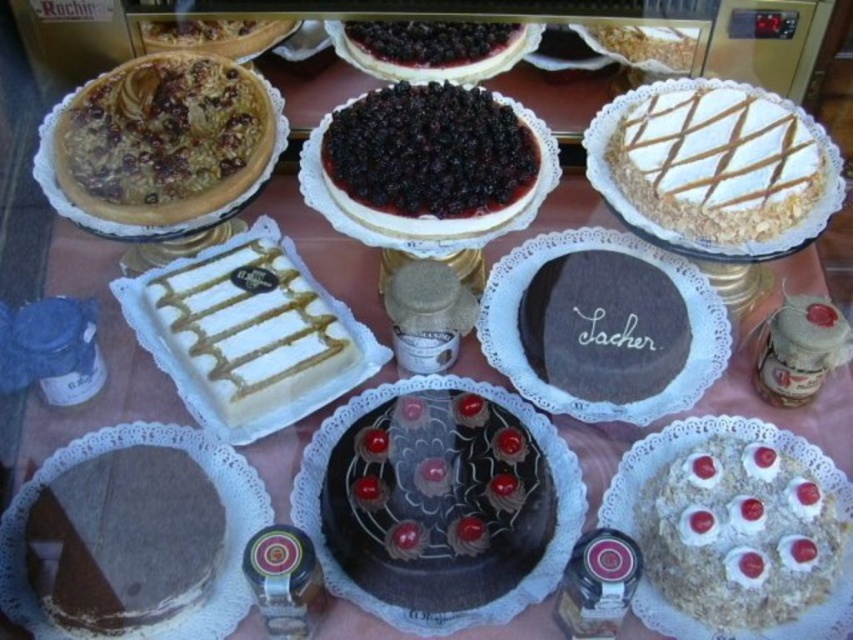
The image size is (853, 640). What do you see at coordinates (436, 500) in the screenshot? I see `chocolate glazed cake at center` at bounding box center [436, 500].

Is chocolate glazed cake at center wider than white glossy cake at center?

In fact, chocolate glazed cake at center might be narrower than white glossy cake at center.

Is point (440, 554) positioned after point (294, 348)?

No.

The image size is (853, 640). What are the coordinates of `chocolate glazed cake at center` in the screenshot? It's located at (436, 500).

Can you confirm if chocolate glazed cake at center is positioned to the left of dark chocolate cake at center?

Correct, you'll find chocolate glazed cake at center to the left of dark chocolate cake at center.

Does chocolate glazed cake at center appear over dark chocolate cake at center?

Incorrect, chocolate glazed cake at center is not positioned above dark chocolate cake at center.

Between point (488, 579) and point (683, 344), which one is positioned behind?

The point (683, 344) is more distant.

Locate an element on the screen. This screenshot has width=853, height=640. chocolate glazed cake at center is located at coordinates (436, 500).

Does white frosted cake with cherries at center have a larger size compared to blackberry-filled cheesecake at center?

Incorrect, white frosted cake with cherries at center is not larger than blackberry-filled cheesecake at center.

Who is positioned more to the right, white frosted cake with cherries at center or blackberry-filled cheesecake at center?

white frosted cake with cherries at center is more to the right.

Which is behind, point (695, 484) or point (368, 198)?

The point (368, 198) is more distant.

Where is `white frosted cake with cherries at center`? Image resolution: width=853 pixels, height=640 pixels. white frosted cake with cherries at center is located at coordinates (741, 528).